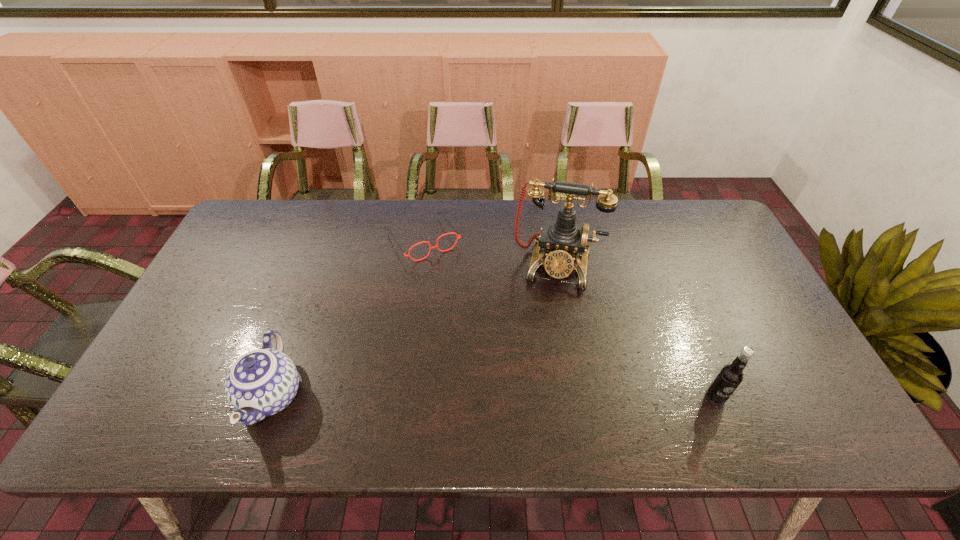
Where is `vacant space at the left edge`? The width and height of the screenshot is (960, 540). vacant space at the left edge is located at coordinates (227, 253).

This screenshot has width=960, height=540. I want to click on free space at the far left corner of the desktop, so click(273, 230).

You are a GUI agent. You are given a task and a screenshot of the screen. Output one action in this format:
    pyautogui.click(x=<x>, y=<y>)
    Task: Click on the vacant space at the near left corner of the desktop
    Image resolution: width=960 pixels, height=540 pixels.
    Given the screenshot: What is the action you would take?
    pyautogui.click(x=194, y=374)

The height and width of the screenshot is (540, 960). Find the location of `unoccupied position between the second object from right to left and the chinaware`. unoccupied position between the second object from right to left and the chinaware is located at coordinates (414, 332).

Locate an element on the screen. The image size is (960, 540). vacant area that lies between the chinaware and the root beer is located at coordinates (493, 396).

Find the location of a particular element. free space between the third tallest object and the spectacles is located at coordinates pos(348,318).

Locate an element on the screen. This screenshot has height=540, width=960. free space between the leftmost object and the third shortest object is located at coordinates (493, 396).

Identify the location of free space between the leftmost object and the second object from left to right. (348, 318).

At what (x,y) coordinates should I click in order to perform the action: click on free space between the leftmost object and the root beer. Please return your answer as a coordinate pair (x, y). The width and height of the screenshot is (960, 540). Looking at the image, I should click on (493, 396).

The height and width of the screenshot is (540, 960). Find the location of `vacant area that lies between the telephone and the second tallest object`. vacant area that lies between the telephone and the second tallest object is located at coordinates (636, 332).